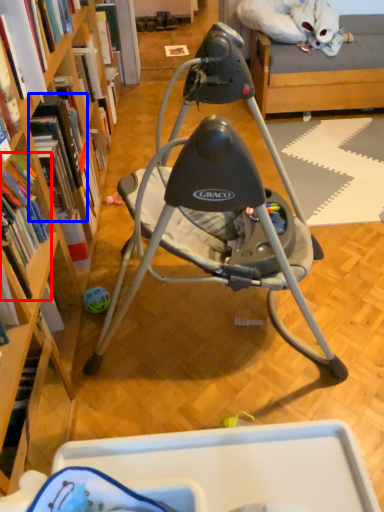
Question: Among these objects, which one is nearest to the camera, book (highlighted by a red box) or book (highlighted by a blue box)?

Choices:
 (A) book
 (B) book

Answer: (A)